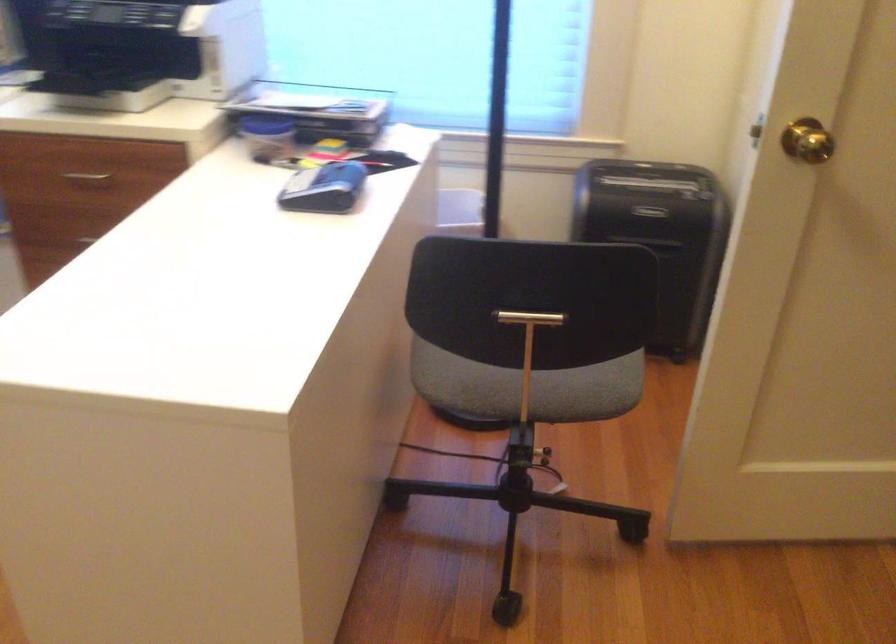
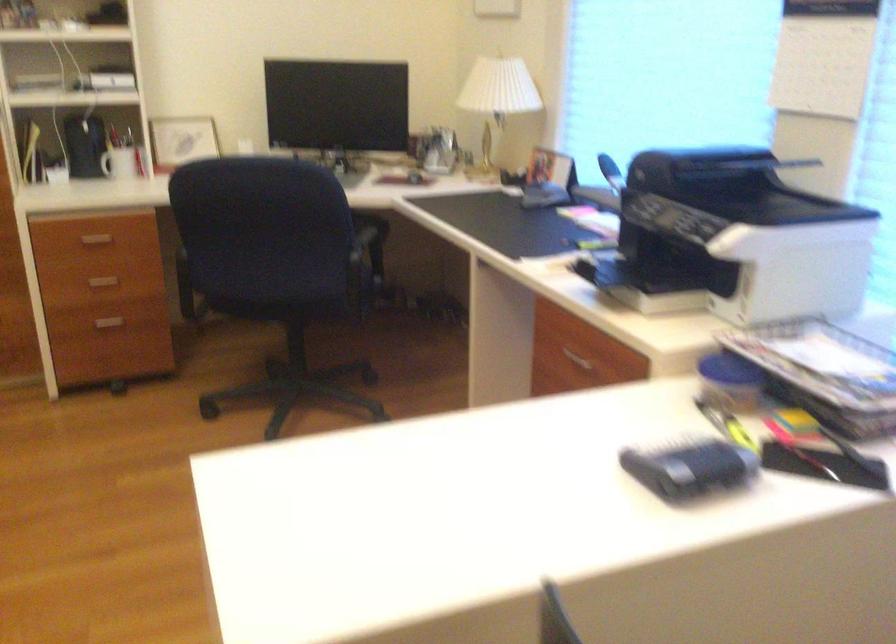
Question: The camera is either moving clockwise (left) or counter-clockwise (right) around the object. The first image is from the beginning of the video and the second image is from the end. Is the camera moving left or right when shooting the video?

Choices:
 (A) Left
 (B) Right

Answer: (B)